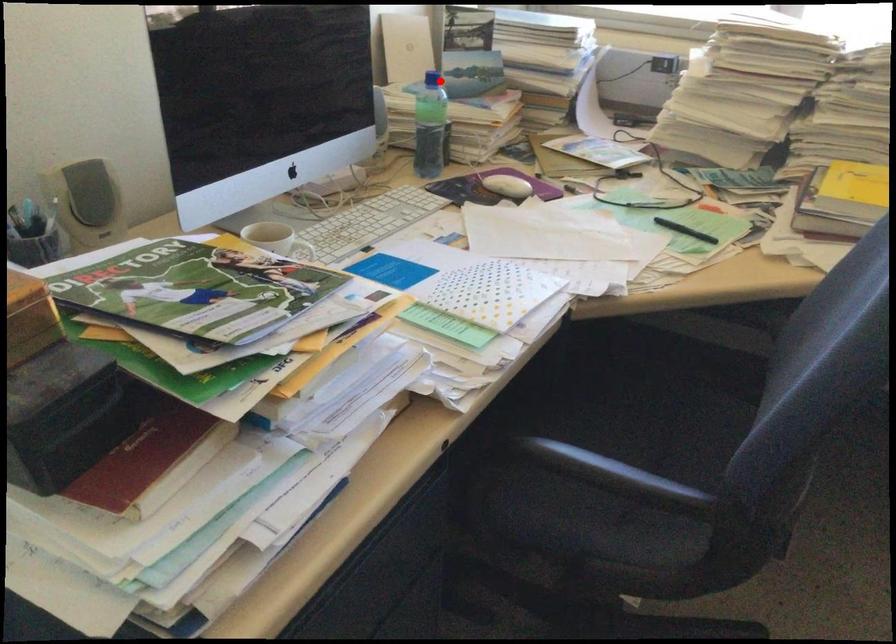
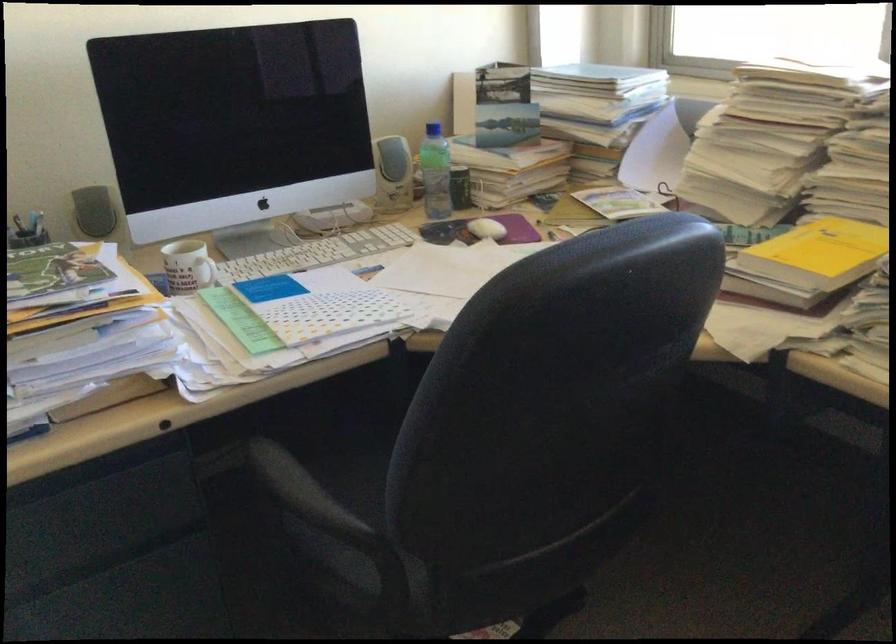
In the second image, find the point that corresponds to the highlighted location in the first image.

(433, 129)